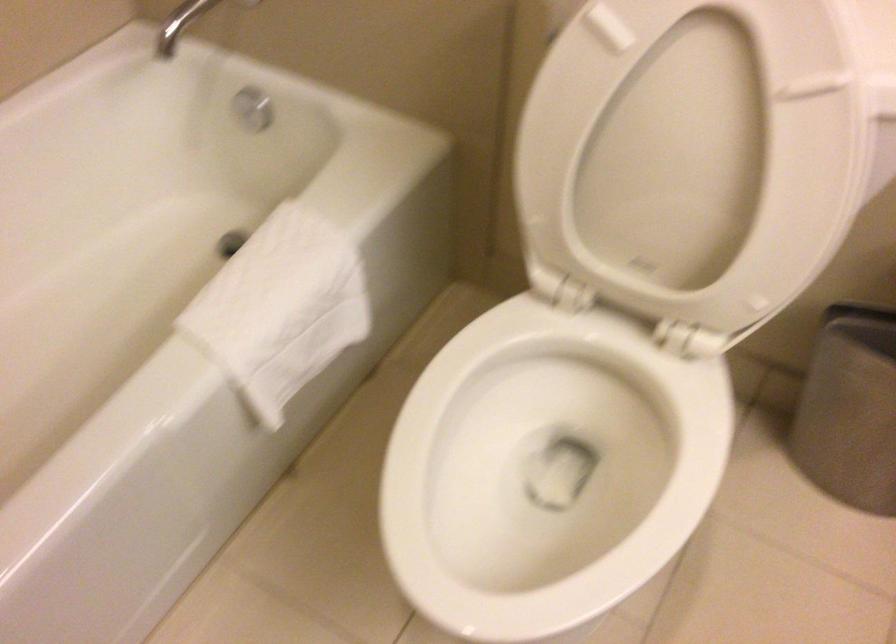
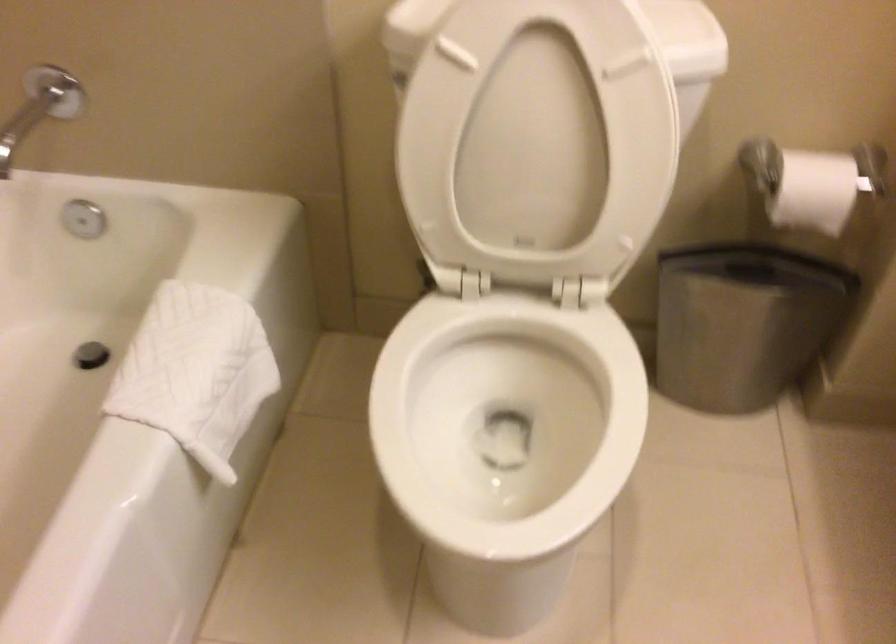
The point at (581, 442) is marked in the first image. Where is the corresponding point in the second image?

(505, 420)